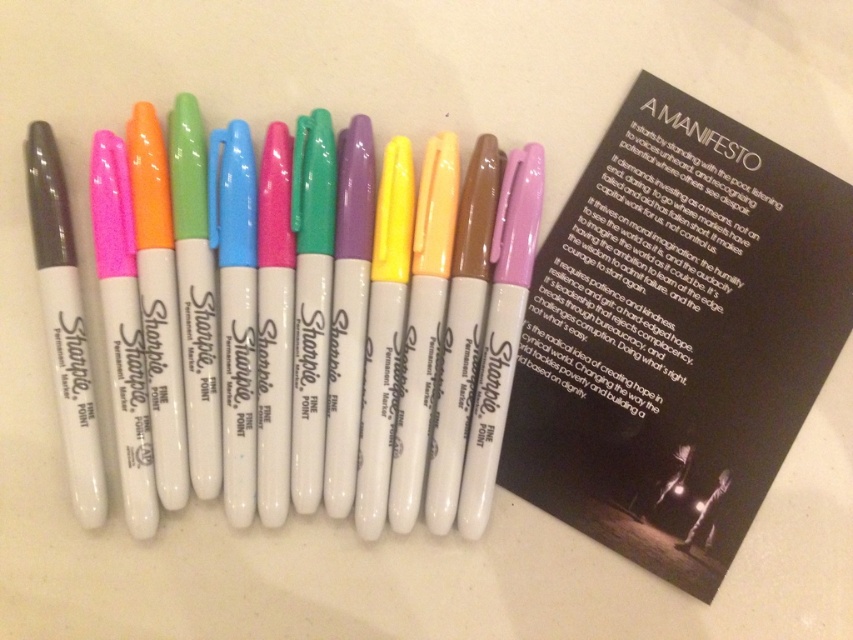
You are a photographer standing at a certain distance from the matte white marker at center. You need to capture a closeup shot of the marker, but your camera can only focus clearly on objects within 1 meter. Can you take the photo without moving closer?

The matte white marker at center is 1.22 meters away from the camera. Since the camera can only focus clearly on objects within 1 meter, you cannot take the closeup shot without moving closer.